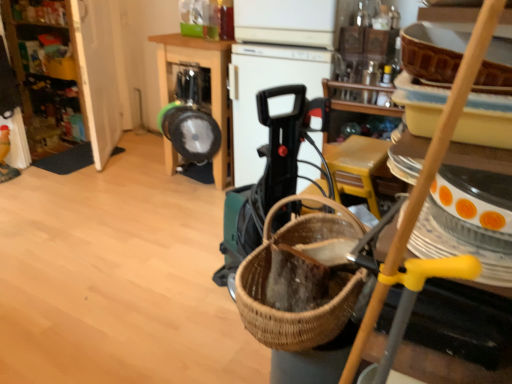
Image resolution: width=512 pixels, height=384 pixels. In order to click on free space in front of metallic silver frying pan at center in this screenshot , I will do `click(174, 206)`.